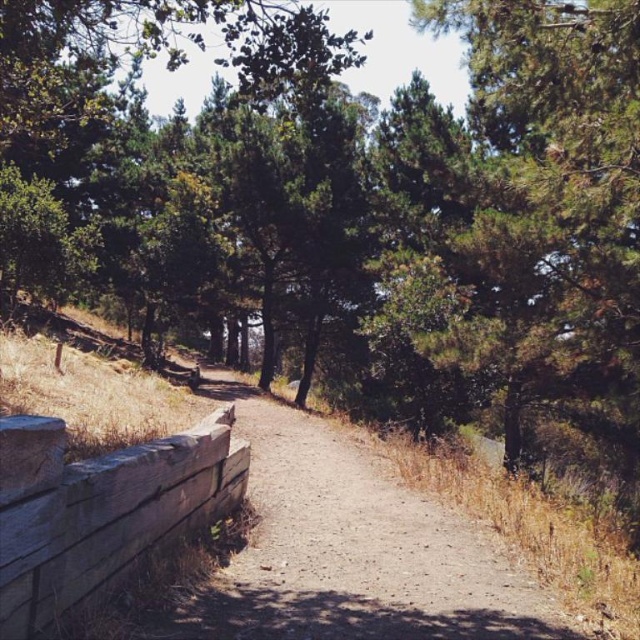
Is dirt path at center thinner than weathered wood at lower left?

In fact, dirt path at center might be wider than weathered wood at lower left.

Is point (394, 500) in front of point (141, 492)?

No, (394, 500) is further to viewer.

Who is more distant from viewer, (208, 634) or (29, 449)?

The point (208, 634) is behind.

The width and height of the screenshot is (640, 640). I want to click on dirt path at center, so click(353, 548).